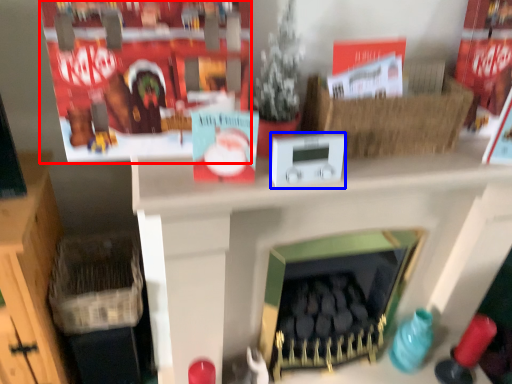
Question: Among these objects, which one is farthest to the camera, shelf (highlighted by a red box) or appliance (highlighted by a blue box)?

Choices:
 (A) shelf
 (B) appliance

Answer: (B)